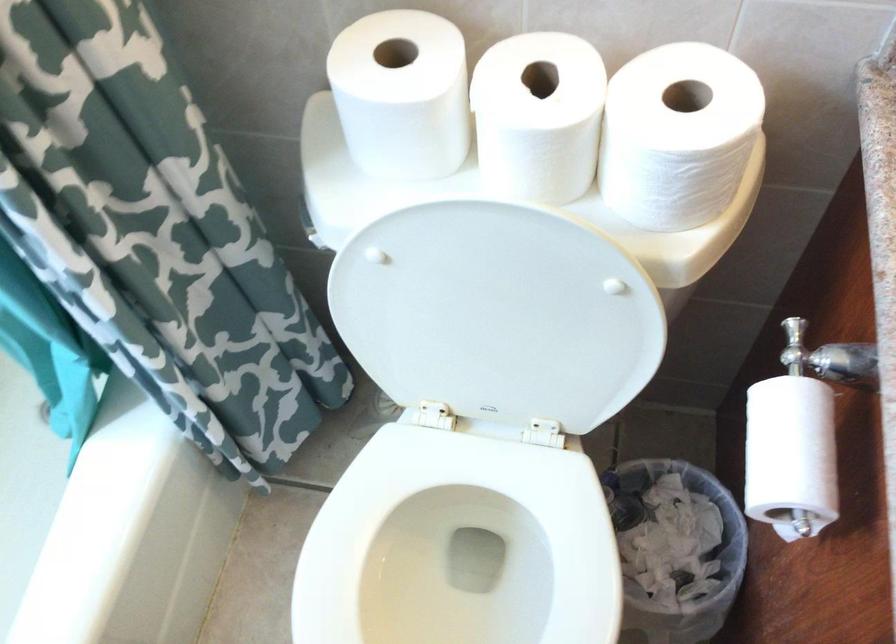
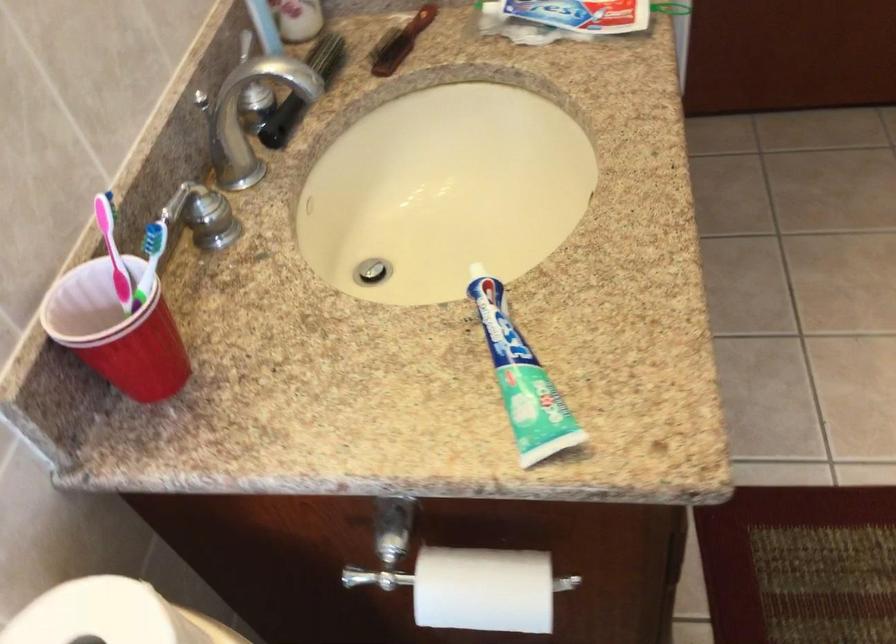
In the second image, find the point that corresponds to (789,451) in the first image.

(483, 589)